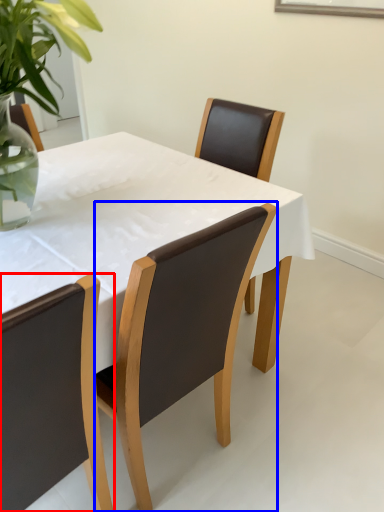
Question: Among these objects, which one is nearest to the camera, chair (highlighted by a red box) or chair (highlighted by a blue box)?

Choices:
 (A) chair
 (B) chair

Answer: (A)